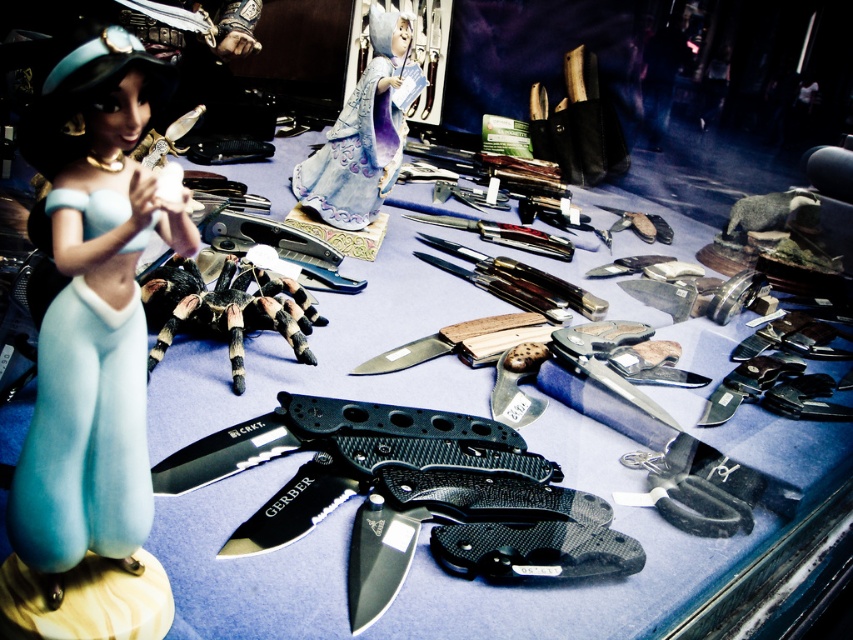
Question: Which point is farther from the camera taking this photo?

Choices:
 (A) [184, 269]
 (B) [132, 248]
 (C) [505, 540]

Answer: (A)

Question: Does black carbon fiber knife at center lie in front of porcelain figurine at center?

Choices:
 (A) no
 (B) yes

Answer: (B)

Question: Considering the relative positions of matte blue figurine at left and black carbon fiber knife at center in the image provided, where is matte blue figurine at left located with respect to black carbon fiber knife at center?

Choices:
 (A) right
 (B) left

Answer: (B)

Question: Which object appears farthest from the camera in this image?

Choices:
 (A) black carbon fiber knife at center
 (B) black hairy tarantula at center

Answer: (B)

Question: Does matte blue figurine at left have a greater width compared to porcelain figurine at center?

Choices:
 (A) no
 (B) yes

Answer: (A)

Question: Which object is positioned farthest from the black hairy tarantula at center?

Choices:
 (A) matte blue figurine at left
 (B) black carbon fiber knife at center
 (C) porcelain figurine at center

Answer: (C)